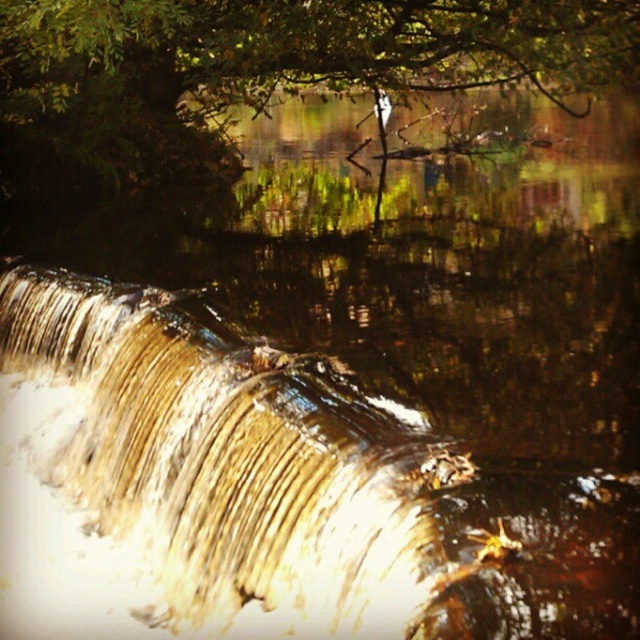
Can you confirm if golden smooth waterfall at center is positioned to the right of green leafy tree at upper center?

No, golden smooth waterfall at center is not to the right of green leafy tree at upper center.

The image size is (640, 640). What are the coordinates of `golden smooth waterfall at center` in the screenshot? It's located at (202, 483).